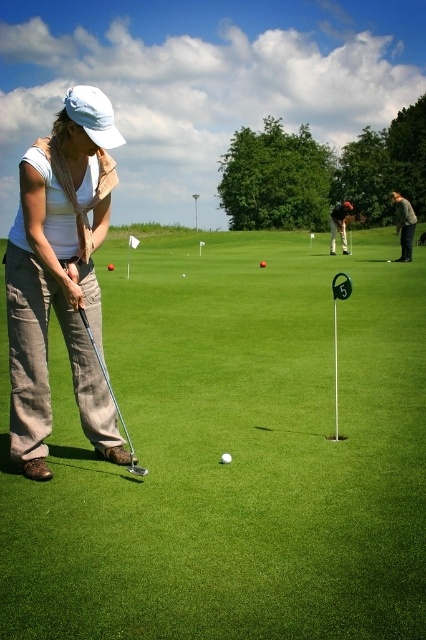
You are a golfer standing on the green grass at center and holding the smooth black golf club at center. If you want to place the club next to the grass, which one would you need to move more to the right to make space?

The green grass at center is wider than the smooth black golf club at center, so you would need to move the green grass at center more to the right to make space.

You are a golfer trying to line up your putt. You notice the matte white cap at upper left and the green matte golf ball at center. Which object is wider from your perspective?

The matte white cap at upper left might be wider than the green matte golf ball at center according to the description.